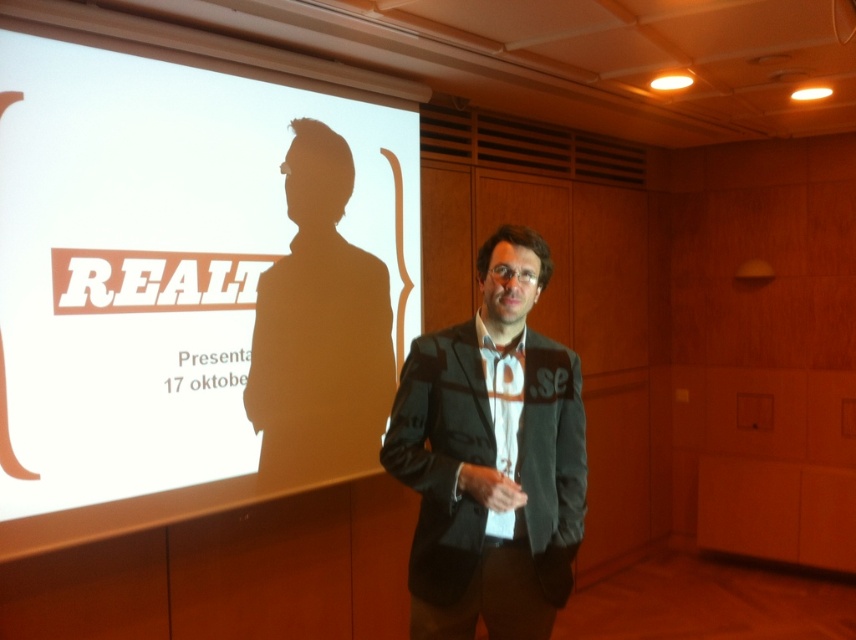
You are an event planner organizing a presentation. You need to ensure that the white matte projection screen at upper left and the dark gray suit at center are visible to all attendees. Given their heights, which object will require more strategic placement to ensure visibility?

The dark gray suit at center will require more strategic placement to ensure visibility because the white matte projection screen at upper left is taller than the dark gray suit at center, making it naturally more visible from a distance.

You are an event organizer who needs to place a 2.5 feet wide table between the dark gray suit at center and the black matte suit at center. Can the table fit between them?

The dark gray suit at center is 3.60 feet from the black matte suit at center. Since the table is 2.5 feet wide, it can fit between them as the distance between the two suits is greater than the table width.